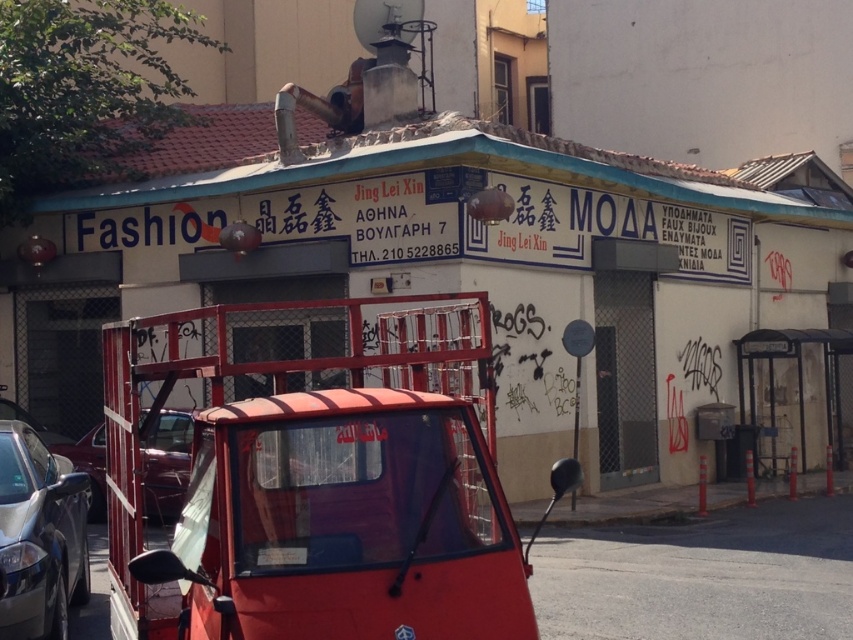
Question: Which point is farther to the camera?

Choices:
 (A) silver metallic car at lower left
 (B) metallic red car at left
 (C) white plastic license plate at center
 (D) metallic red car at lower left

Answer: (D)

Question: Is metallic red car at lower left to the left of white plastic license plate at center from the viewer's perspective?

Choices:
 (A) yes
 (B) no

Answer: (A)

Question: Does silver metallic car at lower left appear under metallic red car at left?

Choices:
 (A) yes
 (B) no

Answer: (A)

Question: Estimate the real-world distances between objects in this image. Which object is farther from the white plastic license plate at center?

Choices:
 (A) metallic red car at lower left
 (B) metallic red car at left

Answer: (A)

Question: Does metallic red car at lower left appear under white plastic license plate at center?

Choices:
 (A) yes
 (B) no

Answer: (A)

Question: Which point appears farthest from the camera in this image?

Choices:
 (A) (16, 465)
 (B) (164, 493)

Answer: (B)